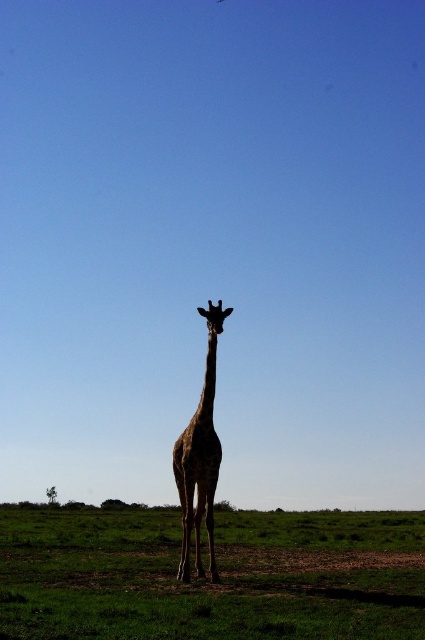
Question: Is green grass at center bigger than spotted fur giraffe at center?

Choices:
 (A) no
 (B) yes

Answer: (B)

Question: Among these objects, which one is farthest from the camera?

Choices:
 (A) green grass at center
 (B) spotted fur giraffe at center

Answer: (B)

Question: Which point is farther to the camera?

Choices:
 (A) (141, 627)
 (B) (209, 362)

Answer: (B)

Question: Does green grass at center appear on the left side of spotted fur giraffe at center?

Choices:
 (A) yes
 (B) no

Answer: (A)

Question: Which object is farther from the camera taking this photo?

Choices:
 (A) green grass at center
 (B) spotted fur giraffe at center

Answer: (B)

Question: Considering the relative positions of green grass at center and spotted fur giraffe at center in the image provided, where is green grass at center located with respect to spotted fur giraffe at center?

Choices:
 (A) above
 (B) below

Answer: (B)